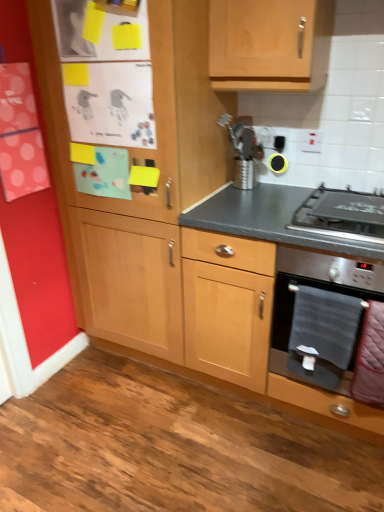
Locate an element on the screen. blank space situated above matte wood cabinet at lower right, which is counted as the 1th cabinetry, starting from the right (from a real-world perspective) is located at coordinates (280, 207).